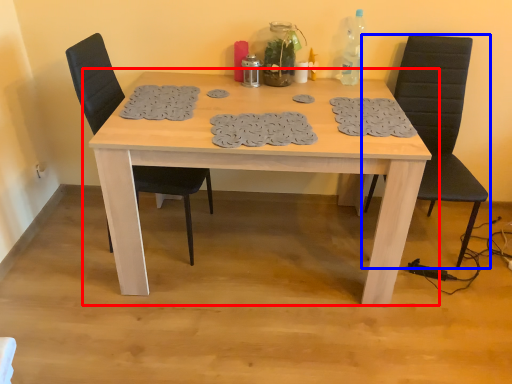
Question: Which object appears closest to the camera in this image, table (highlighted by a red box) or chair (highlighted by a blue box)?

Choices:
 (A) table
 (B) chair

Answer: (A)